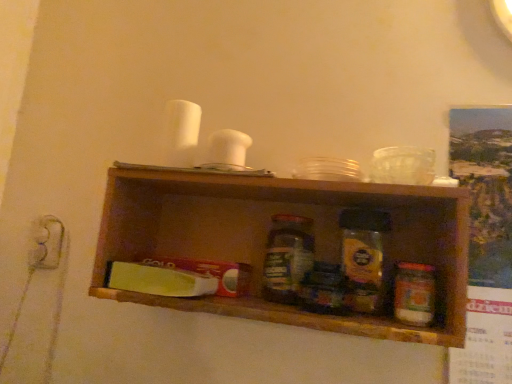
The width and height of the screenshot is (512, 384). In order to click on matte white electric outlet at left in this screenshot , I will do `click(46, 243)`.

Describe the element at coordinates (267, 237) in the screenshot. I see `wooden shelf at center` at that location.

What do you see at coordinates (159, 280) in the screenshot? I see `green plastic butter at center` at bounding box center [159, 280].

Locate an element on the screen. translucent plastic jar at center-right, positioned as the first bottle in front-to-back order is located at coordinates (414, 294).

Considering the sizes of objects matte white electric outlet at left and wooden shelf at center in the image provided, who is smaller, matte white electric outlet at left or wooden shelf at center?

With smaller size is matte white electric outlet at left.

Is matte white electric outlet at left inside the boundaries of wooden shelf at center, or outside?

matte white electric outlet at left lies outside wooden shelf at center.

Find the location of a particular element. shelf in front of the matte white electric outlet at left is located at coordinates [x=267, y=237].

Is point (59, 252) positioned behind point (125, 301)?

Yes.

Relative to matte white electric outlet at left, is translucent glass jar at center, the second bottle positioned from the right, in front or behind?

translucent glass jar at center, the second bottle positioned from the right, is positioned closer to the viewer than matte white electric outlet at left.

Choose the correct answer: Is translucent glass jar at center, the second bottle positioned from the right, inside matte white electric outlet at left or outside it?

The correct answer is: outside.

From a real-world perspective, which object rests below the other?

In real-world perspective, matte white electric outlet at left is lower.

Locate an element on the screen. The width and height of the screenshot is (512, 384). electric outlet behind the translucent glass jar at center, positioned as the 2th bottle in front-to-back order is located at coordinates point(46,243).

From the image's perspective, between matte white electric outlet at left and translucent glass jar at center, the 1th bottle positioned from the back, who is located below?

From the image's view, translucent glass jar at center, the 1th bottle positioned from the back, is below.

Considering the relative sizes of matte white electric outlet at left and translucent glass jar at center, positioned as the 2th bottle in front-to-back order, in the image provided, is matte white electric outlet at left bigger than translucent glass jar at center, positioned as the 2th bottle in front-to-back order,?

Incorrect, matte white electric outlet at left is not larger than translucent glass jar at center, positioned as the 2th bottle in front-to-back order.

Does matte white electric outlet at left lie in front of translucent glass jar at center, the second bottle positioned from the right?

No, matte white electric outlet at left is further to the viewer.

Would you consider matte white electric outlet at left to be distant from translucent glass jar at center, the second bottle positioned from the right?

matte white electric outlet at left is actually quite close to translucent glass jar at center, the second bottle positioned from the right.

Considering the relative sizes of translucent plastic jar at center-right, the 2th bottle viewed from the left, and matte white electric outlet at left in the image provided, is translucent plastic jar at center-right, the 2th bottle viewed from the left, bigger than matte white electric outlet at left?

Yes.

Considering the sizes of objects translucent plastic jar at center-right, the 2th bottle positioned from the back, and matte white electric outlet at left in the image provided, who is thinner, translucent plastic jar at center-right, the 2th bottle positioned from the back, or matte white electric outlet at left?

matte white electric outlet at left is thinner.

Can you confirm if translucent plastic jar at center-right, positioned as the first bottle in front-to-back order, is shorter than matte white electric outlet at left?

Yes.

Between green plastic butter at center and translucent glass jar at center, which appears as the first bottle when viewed from the left, which one is positioned in front?

green plastic butter at center is more forward.

Could you measure the distance between green plastic butter at center and translucent glass jar at center, positioned as the 2th bottle in front-to-back order?

The distance of green plastic butter at center from translucent glass jar at center, positioned as the 2th bottle in front-to-back order, is 6.63 inches.

Identify the location of food below the translucent glass jar at center, positioned as the 2th bottle in front-to-back order (from a real-world perspective). Image resolution: width=512 pixels, height=384 pixels. (159, 280).

Which object is positioned more to the left, matte white electric outlet at left or translucent plastic jar at center-right, the 2th bottle positioned from the back?

Positioned to the left is matte white electric outlet at left.

Does matte white electric outlet at left have a lesser width compared to translucent plastic jar at center-right, positioned as the first bottle in front-to-back order?

Indeed, matte white electric outlet at left has a lesser width compared to translucent plastic jar at center-right, positioned as the first bottle in front-to-back order.

Is matte white electric outlet at left not near translucent plastic jar at center-right, placed as the first bottle when sorted from right to left?

No, matte white electric outlet at left is in close proximity to translucent plastic jar at center-right, placed as the first bottle when sorted from right to left.

Does point (423, 314) come behind point (236, 255)?

No, it is in front of (236, 255).

Starting from the wooden shelf at center, which bottle is the 1st one behind? Please provide its 2D coordinates.

[(414, 294)]

Could you tell me if translucent plastic jar at center-right, the 2th bottle viewed from the left, is facing wooden shelf at center?

Yes, translucent plastic jar at center-right, the 2th bottle viewed from the left, is aimed at wooden shelf at center.

Is translucent plastic jar at center-right, placed as the first bottle when sorted from right to left, at the right side of wooden shelf at center?

Yes.

Image resolution: width=512 pixels, height=384 pixels. Identify the location of electric outlet below the wooden shelf at center (from the image's perspective). (46, 243).

Locate an element on the screen. electric outlet above the translucent glass jar at center, which appears as the first bottle when viewed from the left (from the image's perspective) is located at coordinates (46, 243).

From the image, which object appears to be farther from translucent plastic jar at center-right, the 2th bottle positioned from the back, translucent glass jar at center or translucent glass jar at center, the 1th bottle positioned from the back?

Among the two, translucent glass jar at center, the 1th bottle positioned from the back, is located further to translucent plastic jar at center-right, the 2th bottle positioned from the back.

Looking at the image, which one is located closer to translucent glass jar at center, green plastic butter at center or matte white electric outlet at left?

Based on the image, green plastic butter at center appears to be nearer to translucent glass jar at center.

Which object lies nearer to the anchor point translucent glass jar at center, green plastic butter at center or translucent glass jar at center, which appears as the first bottle when viewed from the left?

translucent glass jar at center, which appears as the first bottle when viewed from the left.

Which object lies nearer to the anchor point translucent plastic jar at center-right, the 2th bottle positioned from the back, translucent glass jar at center, the 1th bottle positioned from the back, or translucent glass jar at center?

translucent glass jar at center lies closer to translucent plastic jar at center-right, the 2th bottle positioned from the back, than the other object.

Which object lies further to the anchor point wooden shelf at center, green plastic butter at center or matte white electric outlet at left?

matte white electric outlet at left is further to wooden shelf at center.

Estimate the real-world distances between objects in this image. Which object is further from matte white electric outlet at left, wooden shelf at center or translucent glass jar at center, positioned as the 2th bottle in front-to-back order?

translucent glass jar at center, positioned as the 2th bottle in front-to-back order, lies further to matte white electric outlet at left than the other object.

From the image, which object appears to be farther from green plastic butter at center, matte white electric outlet at left or translucent plastic jar at center-right, the 2th bottle positioned from the back?

The object further to green plastic butter at center is translucent plastic jar at center-right, the 2th bottle positioned from the back.

Considering their positions, is translucent glass jar at center, the 1th bottle positioned from the back, positioned further to translucent plastic jar at center-right, placed as the first bottle when sorted from right to left, than matte white electric outlet at left?

matte white electric outlet at left is further to translucent plastic jar at center-right, placed as the first bottle when sorted from right to left.

The height and width of the screenshot is (384, 512). What are the coordinates of `food between matte white electric outlet at left and translucent glass jar at center` in the screenshot? It's located at (159, 280).

This screenshot has height=384, width=512. What are the coordinates of `glass jar located between green plastic butter at center and translucent plastic jar at center-right, the 2th bottle viewed from the left, in the left-right direction` in the screenshot? It's located at (362, 258).

You are a GUI agent. You are given a task and a screenshot of the screen. Output one action in this format:
    pyautogui.click(x=<x>, y=<y>)
    Task: Click on the shelf between matte white electric outlet at left and translucent glass jar at center, the 1th bottle positioned from the back, in the horizontal direction
    The height and width of the screenshot is (384, 512).
    Given the screenshot: What is the action you would take?
    pyautogui.click(x=267, y=237)

The height and width of the screenshot is (384, 512). What are the coordinates of `bottle between green plastic butter at center and translucent plastic jar at center-right, the 2th bottle positioned from the back, from left to right` in the screenshot? It's located at (287, 257).